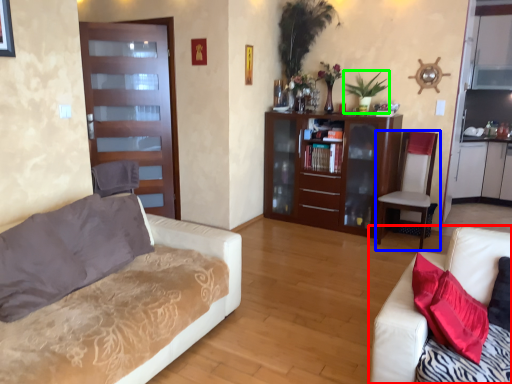
Question: Which is nearer to the studio couch (highlighted by a red box)? chair (highlighted by a blue box) or plant (highlighted by a green box).

Choices:
 (A) chair
 (B) plant

Answer: (A)